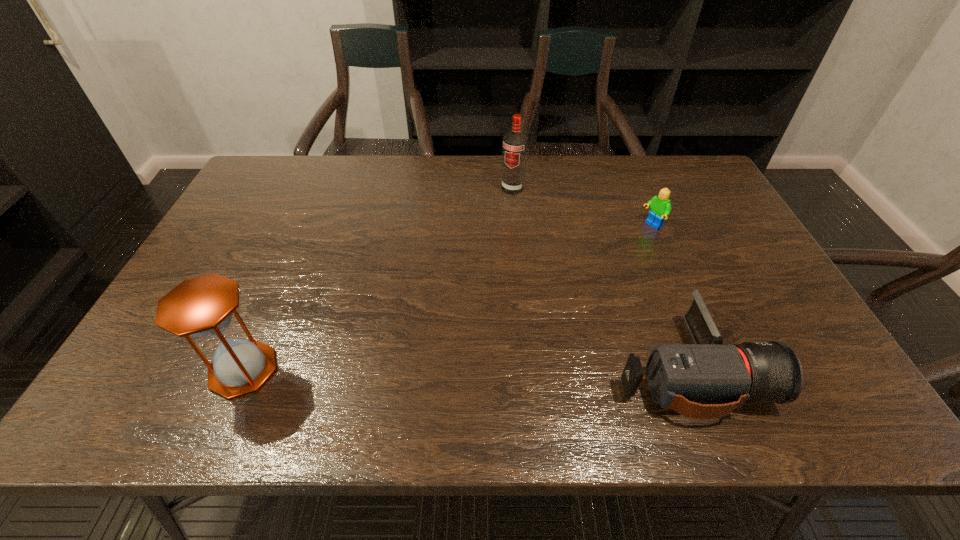
Find the location of a particular element. This screenshot has width=960, height=540. the leftmost object is located at coordinates (202, 307).

Where is `camcorder`? camcorder is located at coordinates (705, 380).

Locate an element on the screen. Lego is located at coordinates (660, 205).

Find the location of a particular element. The height and width of the screenshot is (540, 960). vodka is located at coordinates (515, 143).

Locate an element on the screen. This screenshot has height=540, width=960. the farthest object is located at coordinates (515, 143).

Identify the location of free location located on the back of the hourglass. (297, 246).

Find the location of a particular element. This screenshot has height=540, width=960. free space located on the lens of the camcorder is located at coordinates (822, 368).

I want to click on free space located on the face of the Lego, so click(x=569, y=273).

Identify the location of free space located on the face of the Lego. The width and height of the screenshot is (960, 540). (599, 256).

What are the coordinates of `vacant space positioned 0.120m on the face of the Lego` in the screenshot? It's located at (616, 247).